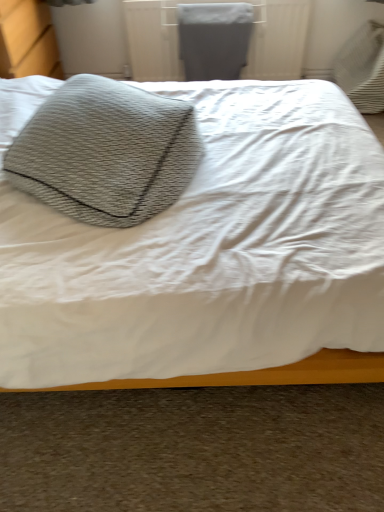
Question: Is matte gray radiator at upper center in front of or behind textured gray pillow at upper left in the image?

Choices:
 (A) behind
 (B) front

Answer: (A)

Question: Considering the relative positions of matte gray radiator at upper center and textured gray pillow at upper left in the image provided, is matte gray radiator at upper center to the left or to the right of textured gray pillow at upper left?

Choices:
 (A) left
 (B) right

Answer: (B)

Question: Which is farther from the textured gray pillow at upper left?

Choices:
 (A) textured gray pillow at upper left
 (B) matte gray radiator at upper center

Answer: (B)

Question: Based on their relative distances, which object is nearer to the textured gray pillow at upper left?

Choices:
 (A) matte gray radiator at upper center
 (B) textured gray pillow at upper left

Answer: (B)